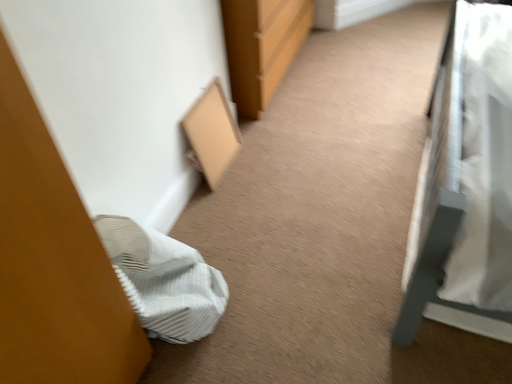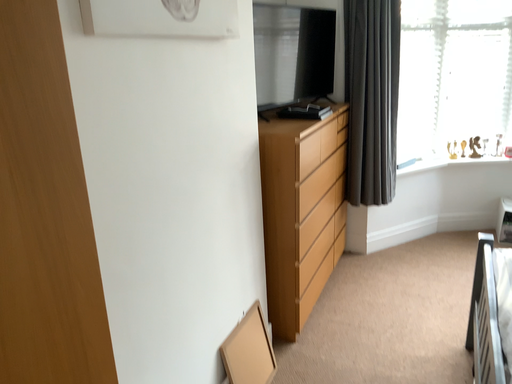
Question: Which way did the camera rotate in the video?

Choices:
 (A) rotated downward
 (B) rotated upward

Answer: (B)